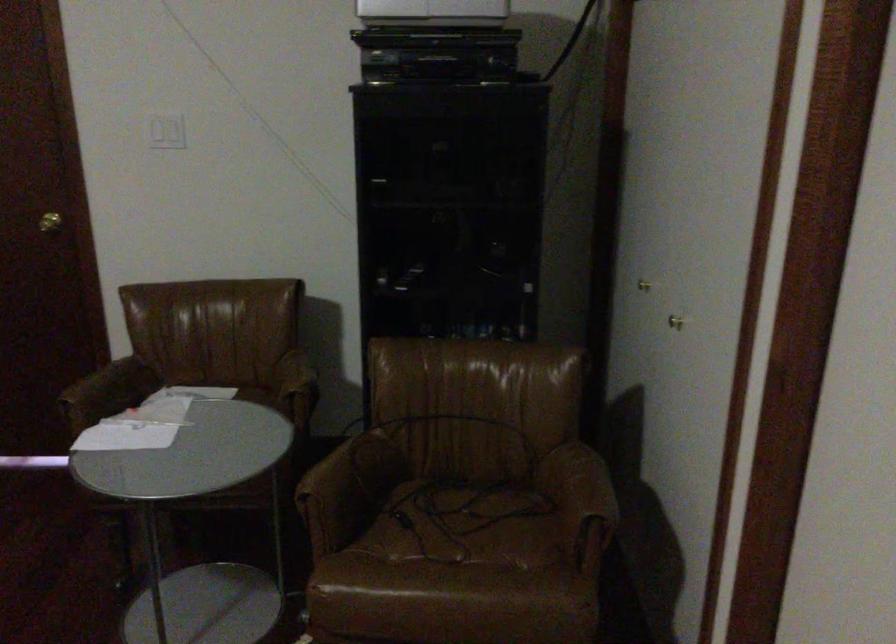
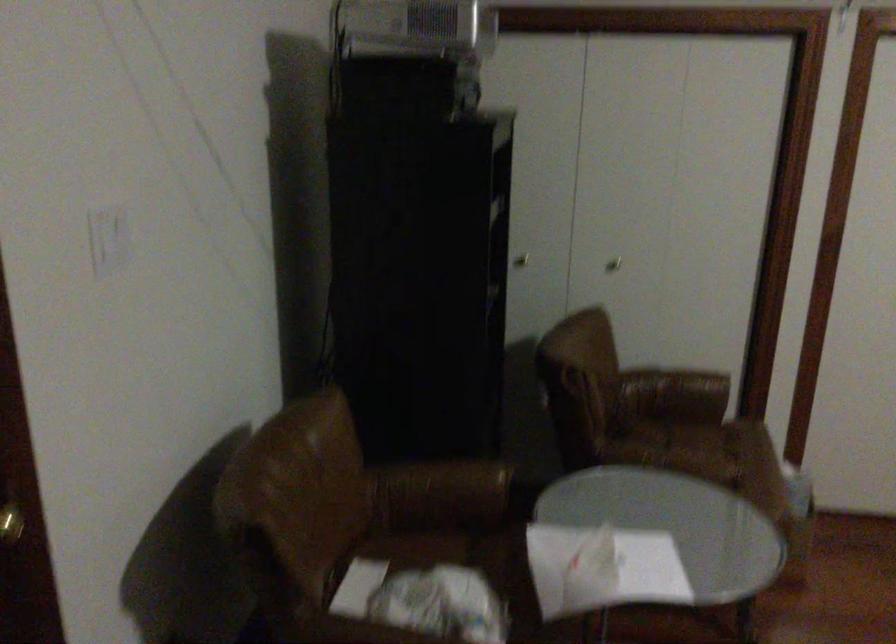
Find the pixel in the second image that matches [676,330] in the first image.

(613, 263)